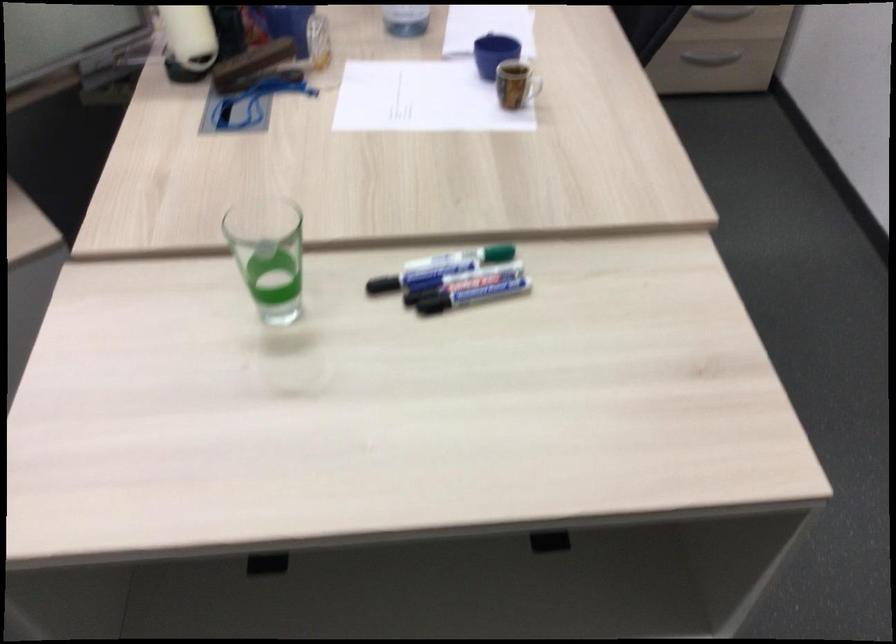
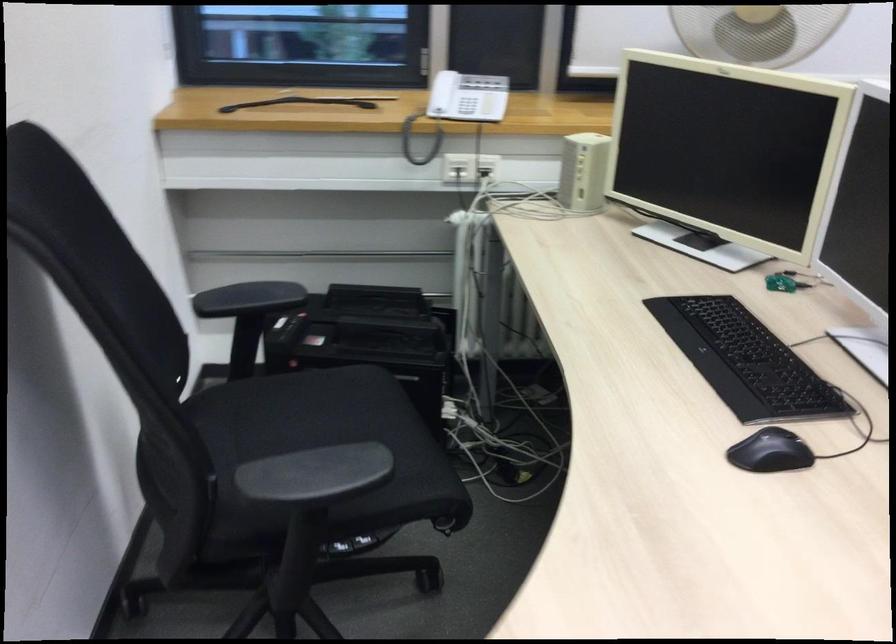
What movement of the cameraman would produce the second image?

The cameraman walked toward left, forward.